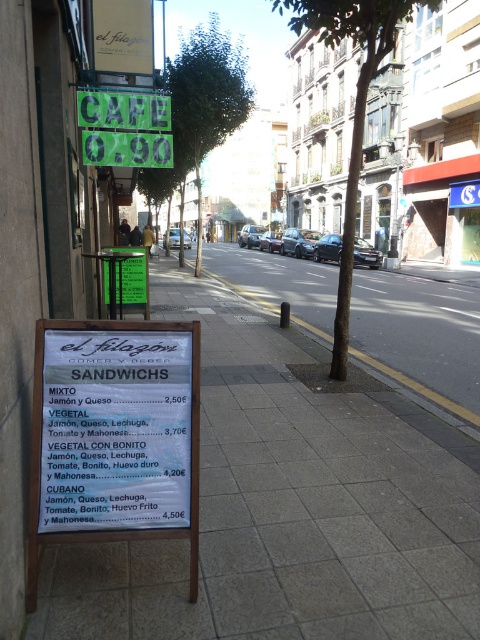
Is point (302, 4) less distant than point (143, 108)?

That is True.

In the scene shown: Can you confirm if green leafy tree at center is smaller than green plastic sign at upper center?

No.

Find the location of `green leafy tree at center`. green leafy tree at center is located at coordinates (354, 108).

The height and width of the screenshot is (640, 480). What do you see at coordinates (288, 504) in the screenshot?
I see `white tile pavement at lower center` at bounding box center [288, 504].

At what (x,y) coordinates should I click in order to perform the action: click on white tile pavement at lower center. Please return your answer as a coordinate pair (x, y). The height and width of the screenshot is (640, 480). Looking at the image, I should click on (288, 504).

What do you see at coordinates (288, 504) in the screenshot? The height and width of the screenshot is (640, 480). I see `white tile pavement at lower center` at bounding box center [288, 504].

Does white tile pavement at lower center appear on the left side of green leafy tree at upper center?

Incorrect, white tile pavement at lower center is not on the left side of green leafy tree at upper center.

Where is `white tile pavement at lower center`? The height and width of the screenshot is (640, 480). white tile pavement at lower center is located at coordinates (288, 504).